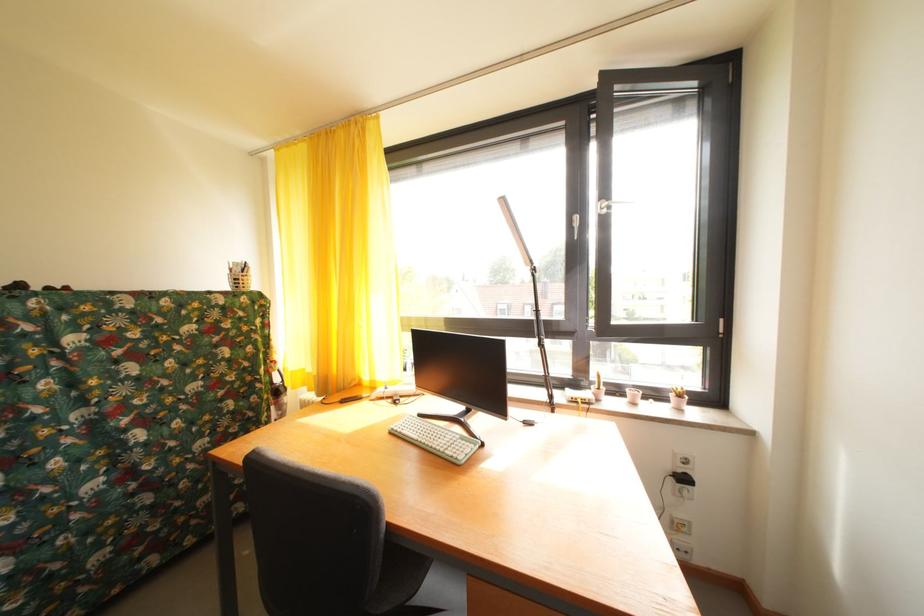
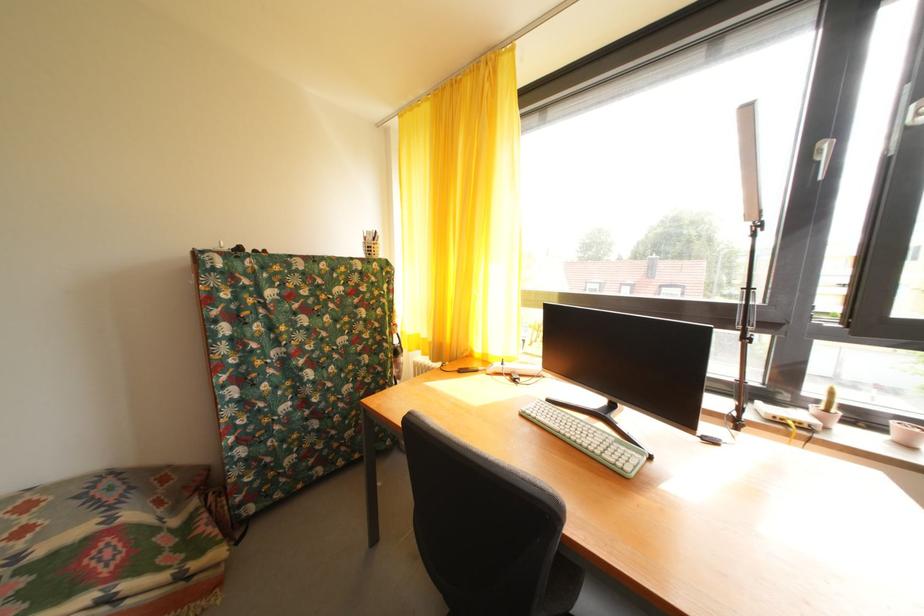
What movement of the cameraman would produce the second image?

The movement direction of the cameraman is left, forward.